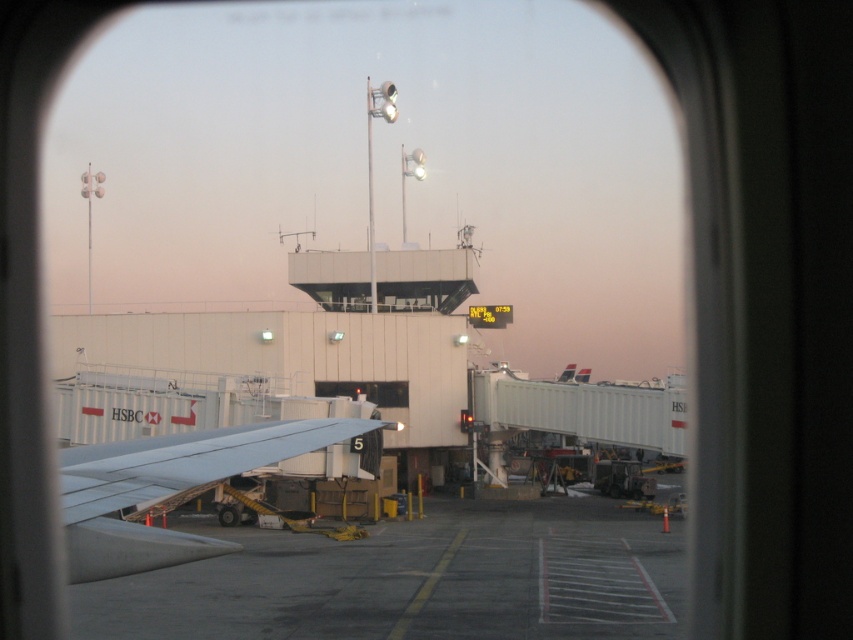
Which is in front, point (157, 484) or point (370, 387)?

Point (157, 484) is more forward.

Can you confirm if light gray metallic wing at lower left is shorter than transparent glass window at center?

Incorrect, light gray metallic wing at lower left's height does not fall short of transparent glass window at center's.

Does point (94, 566) lie behind point (387, 388)?

No, (94, 566) is in front of (387, 388).

The image size is (853, 640). I want to click on light gray metallic wing at lower left, so click(169, 486).

Which of these two, gray concrete tarmac at center or light gray metallic wing at lower left, stands taller?

gray concrete tarmac at center is taller.

Can you confirm if gray concrete tarmac at center is shorter than light gray metallic wing at lower left?

No, gray concrete tarmac at center is not shorter than light gray metallic wing at lower left.

Identify the location of gray concrete tarmac at center. The image size is (853, 640). [x=416, y=579].

Can you confirm if gray concrete tarmac at center is taller than transparent glass window at center?

Yes, gray concrete tarmac at center is taller than transparent glass window at center.

Consider the image. Which is more to the right, gray concrete tarmac at center or transparent glass window at center?

gray concrete tarmac at center

Which is behind, point (403, 576) or point (387, 385)?

Positioned behind is point (387, 385).

Identify the location of gray concrete tarmac at center. (416, 579).